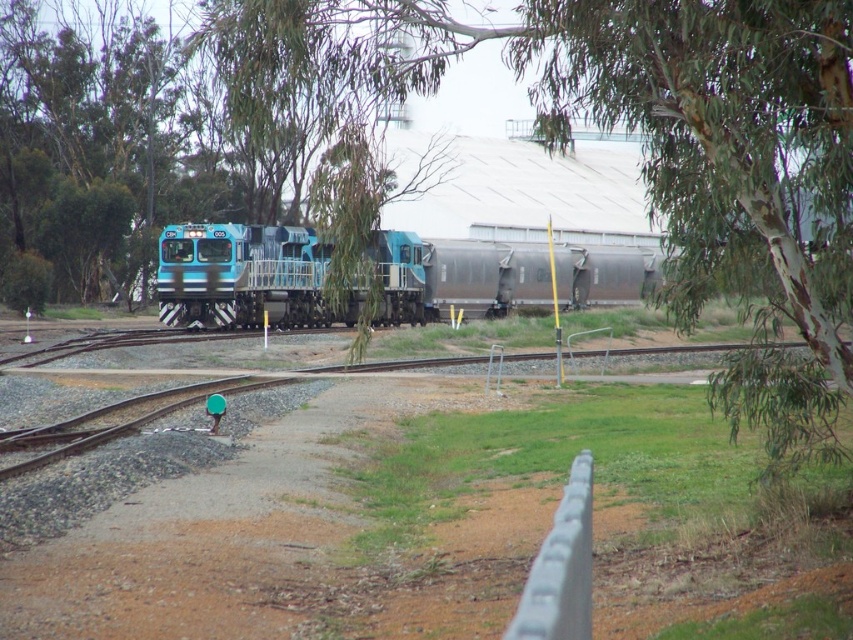
Between point (689, 257) and point (633, 260), which one is positioned behind?

The point (633, 260) is behind.

Between green leafy tree at upper center and blue metallic train at center, which one appears on the left side from the viewer's perspective?

blue metallic train at center

In order to click on green leafy tree at upper center in this screenshot , I will do `click(645, 148)`.

I want to click on green leafy tree at upper center, so click(x=645, y=148).

Is green leafy tree at upper center to the right of gray metallic rail at lower center from the viewer's perspective?

No, green leafy tree at upper center is not to the right of gray metallic rail at lower center.

Is green leafy tree at upper center bigger than gray metallic rail at lower center?

Yes, green leafy tree at upper center is bigger than gray metallic rail at lower center.

Does point (824, 140) come closer to viewer compared to point (550, 636)?

That is False.

Find the location of a particular element. The image size is (853, 640). green leafy tree at upper center is located at coordinates (645, 148).

Does blue metallic train at center appear over gray metallic rail at lower center?

Yes, blue metallic train at center is above gray metallic rail at lower center.

Is the position of blue metallic train at center more distant than that of gray metallic rail at lower center?

Yes, blue metallic train at center is further from the viewer.

Measure the distance between point (642,268) and camera.

266.81 feet

Where is `blue metallic train at center`? This screenshot has width=853, height=640. blue metallic train at center is located at coordinates (244, 276).